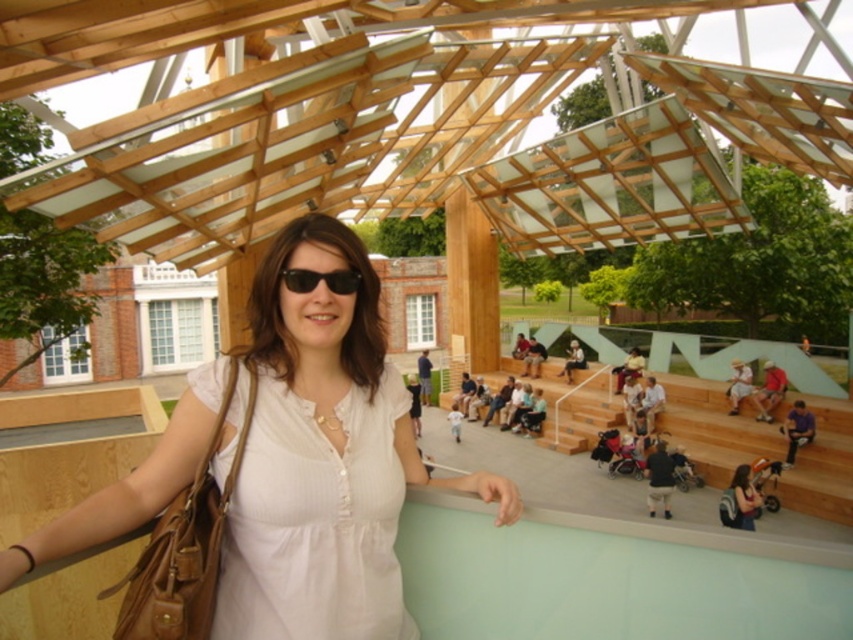
Based on the coordinates provided in the scene description, where is the white matte dress at center located?

The white matte dress at center is located at point coordinates of 0.742 on the x axis and 0.321 on the y axis.

You are standing at the point marked by the coordinates point (740, 500). Looking around, you see the woman in the foreground and the modern wooden structure with its geometric design. Which direction should you move to reach the woman?

Since the point (740, 500) corresponds to the matte brown backpack at lower right, you should move towards the center or left to reach the woman in the foreground.